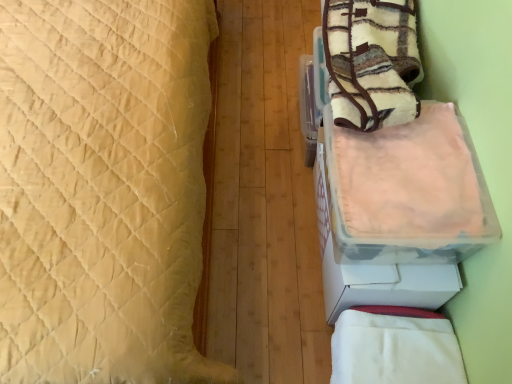
Question: Is white soft blanket at lower right, acting as the second blanket starting from the top, smaller than fluffy fleece blanket at upper right, the 1th blanket positioned from the top?

Choices:
 (A) yes
 (B) no

Answer: (A)

Question: Is white soft blanket at lower right, acting as the second blanket starting from the top, at the right side of fluffy fleece blanket at upper right, the 1th blanket positioned from the top?

Choices:
 (A) yes
 (B) no

Answer: (B)

Question: Considering the relative sizes of white soft blanket at lower right, acting as the 1th blanket starting from the bottom, and fluffy fleece blanket at upper right, the 1th blanket positioned from the top, in the image provided, is white soft blanket at lower right, acting as the 1th blanket starting from the bottom, wider than fluffy fleece blanket at upper right, the 1th blanket positioned from the top,?

Choices:
 (A) yes
 (B) no

Answer: (B)

Question: Is white soft blanket at lower right, acting as the second blanket starting from the top, not inside fluffy fleece blanket at upper right, the 2th blanket ordered from the bottom?

Choices:
 (A) yes
 (B) no

Answer: (A)

Question: Does white soft blanket at lower right, acting as the 1th blanket starting from the bottom, have a lesser width compared to fluffy fleece blanket at upper right, the 2th blanket ordered from the bottom?

Choices:
 (A) no
 (B) yes

Answer: (B)

Question: Is translucent plastic container at right in front of or behind white soft blanket at lower right, acting as the 1th blanket starting from the bottom, in the image?

Choices:
 (A) behind
 (B) front

Answer: (B)

Question: From the image's perspective, is translucent plastic container at right above or below white soft blanket at lower right, acting as the second blanket starting from the top?

Choices:
 (A) below
 (B) above

Answer: (B)

Question: Visually, is translucent plastic container at right positioned to the left or to the right of white soft blanket at lower right, acting as the 1th blanket starting from the bottom?

Choices:
 (A) right
 (B) left

Answer: (B)

Question: Considering the positions of translucent plastic container at right and white soft blanket at lower right, acting as the 1th blanket starting from the bottom, in the image, is translucent plastic container at right bigger or smaller than white soft blanket at lower right, acting as the 1th blanket starting from the bottom,?

Choices:
 (A) big
 (B) small

Answer: (A)

Question: Would you say fluffy fleece blanket at upper right, the 2th blanket ordered from the bottom, is inside or outside white soft blanket at lower right, acting as the 1th blanket starting from the bottom?

Choices:
 (A) outside
 (B) inside

Answer: (A)

Question: From the image's perspective, is fluffy fleece blanket at upper right, the 2th blanket ordered from the bottom, above or below white soft blanket at lower right, acting as the 1th blanket starting from the bottom?

Choices:
 (A) above
 (B) below

Answer: (A)

Question: Is fluffy fleece blanket at upper right, the 1th blanket positioned from the top, wider or thinner than white soft blanket at lower right, acting as the second blanket starting from the top?

Choices:
 (A) thin
 (B) wide

Answer: (B)

Question: In the image, is fluffy fleece blanket at upper right, the 1th blanket positioned from the top, on the left side or the right side of white soft blanket at lower right, acting as the second blanket starting from the top?

Choices:
 (A) right
 (B) left

Answer: (A)

Question: From the image's perspective, is white soft blanket at lower right, acting as the second blanket starting from the top, positioned above or below beige quilted bed at left?

Choices:
 (A) below
 (B) above

Answer: (A)

Question: Visually, is white soft blanket at lower right, acting as the second blanket starting from the top, positioned to the left or to the right of beige quilted bed at left?

Choices:
 (A) left
 (B) right

Answer: (B)